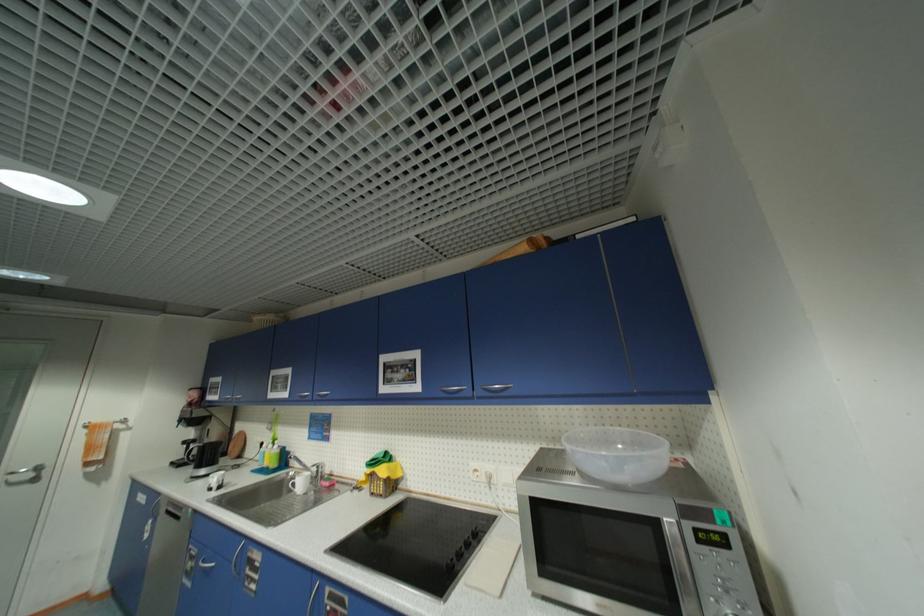
Identify the location of silver door handle. The width and height of the screenshot is (924, 616). (23, 472).